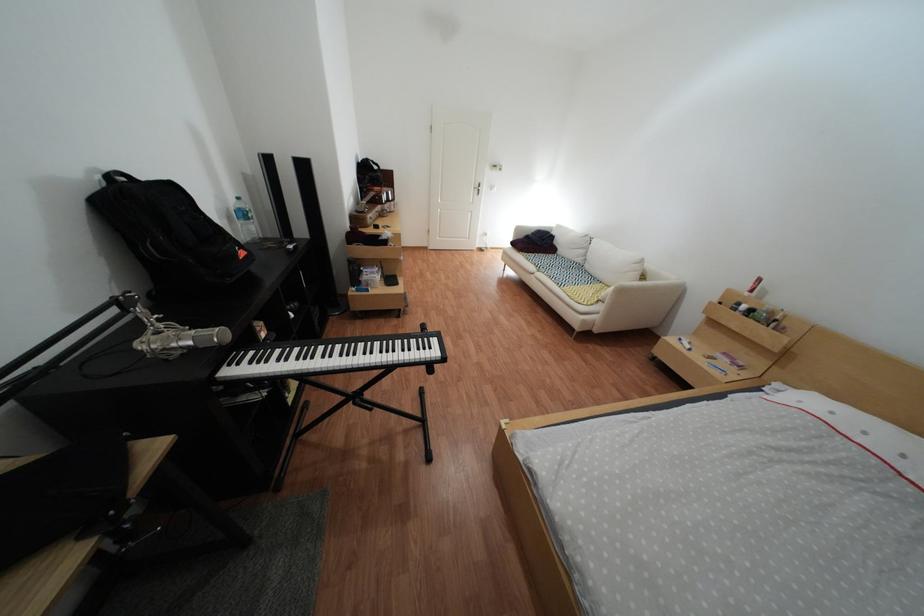
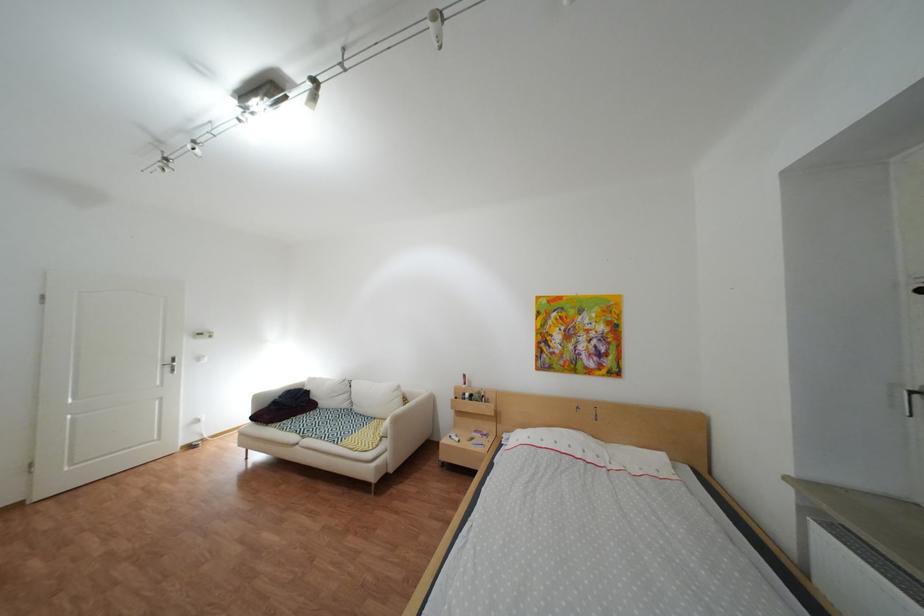
Where in the second image is the point corresponding to pixel 755 305 from the first image?

(480, 395)